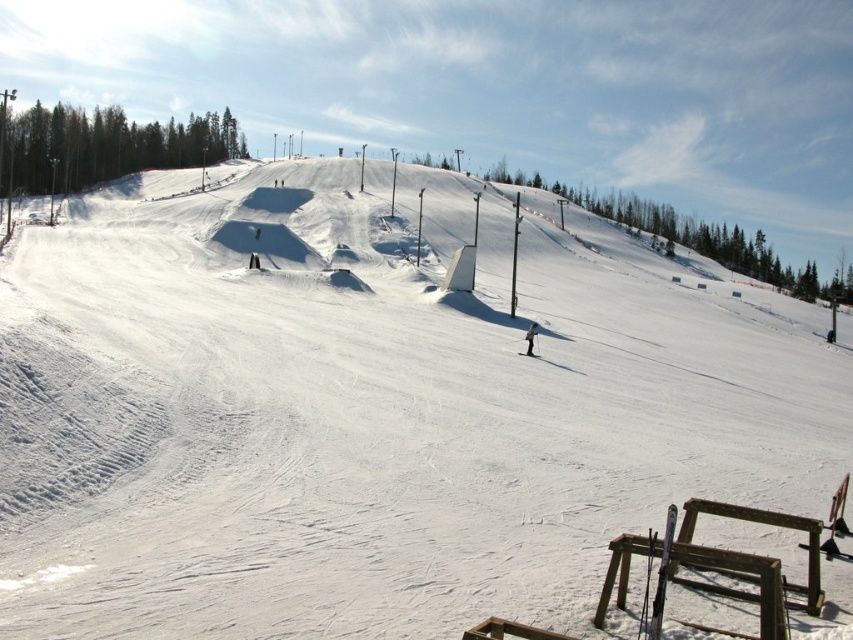
You are standing at the bottom of the slope and want to retrieve both the matte black ski at lower right and the black matte skier at center. Which object should you pick up first based on their proximity to you?

The matte black ski at lower right is closer to the viewer than the black matte skier at center, so you should pick up the matte black ski at lower right first.

You are a photographer trying to capture a clear shot of both the matte black ski at lower right and the black matte skier at center. Considering their positions, which object will appear larger in your photo?

The matte black ski at lower right appears larger in the photo because it has a greater height compared to the black matte skier at center.

You are a skier planning to retrieve your matte black ski at lower right from where you are standing next to the black matte skier at center. Given that your maximum reach is 1 meter without moving, can you grab it?

The matte black ski at lower right and black matte skier at center are 30.79 meters apart from each other, so you cannot reach the matte black ski at lower right with just a 1 meter reach.